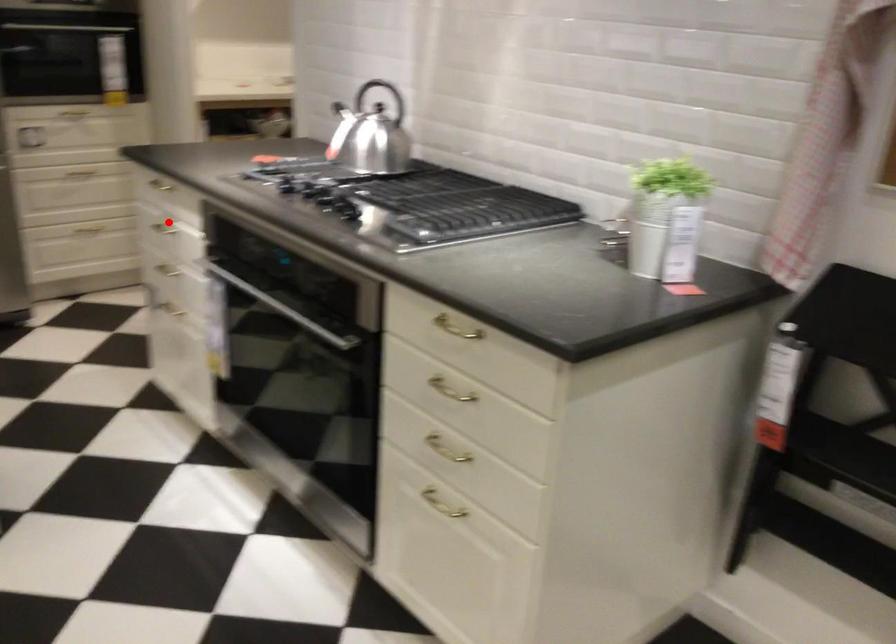
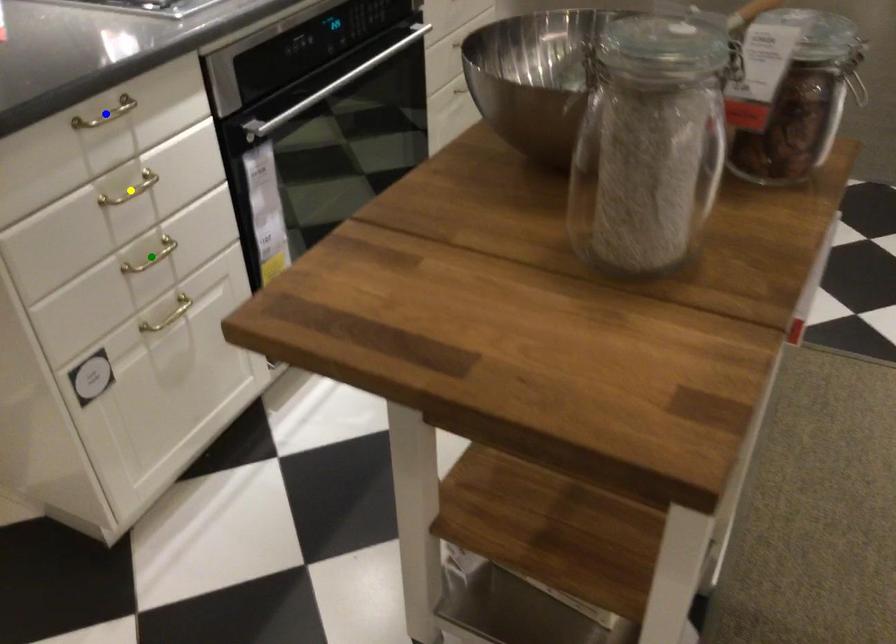
Question: I am providing you with two images of the same scene from different viewpoints. A red point is marked on the first image. You are given multiple points on the second image. Which spot in image 2 lines up with the point in image 1?

Choices:
 (A) yellow point
 (B) green point
 (C) blue point

Answer: (A)